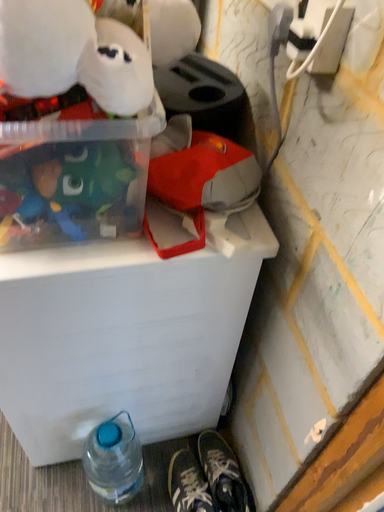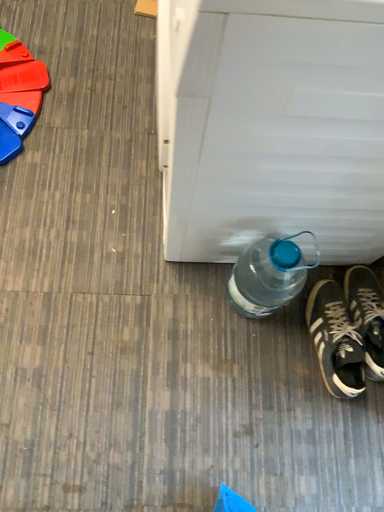
Question: Which way did the camera rotate in the video?

Choices:
 (A) rotated left
 (B) rotated right

Answer: (A)